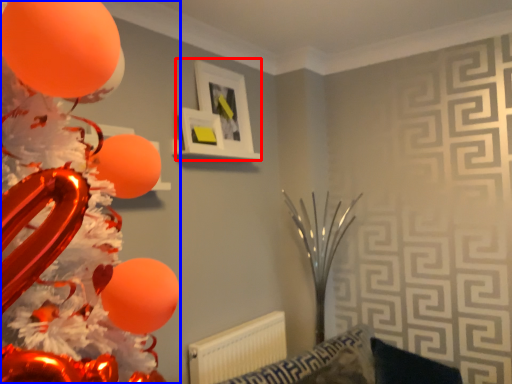
Question: Which point is closer to the camera, picture frame (highlighted by a red box) or balloon (highlighted by a blue box)?

Choices:
 (A) picture frame
 (B) balloon

Answer: (B)